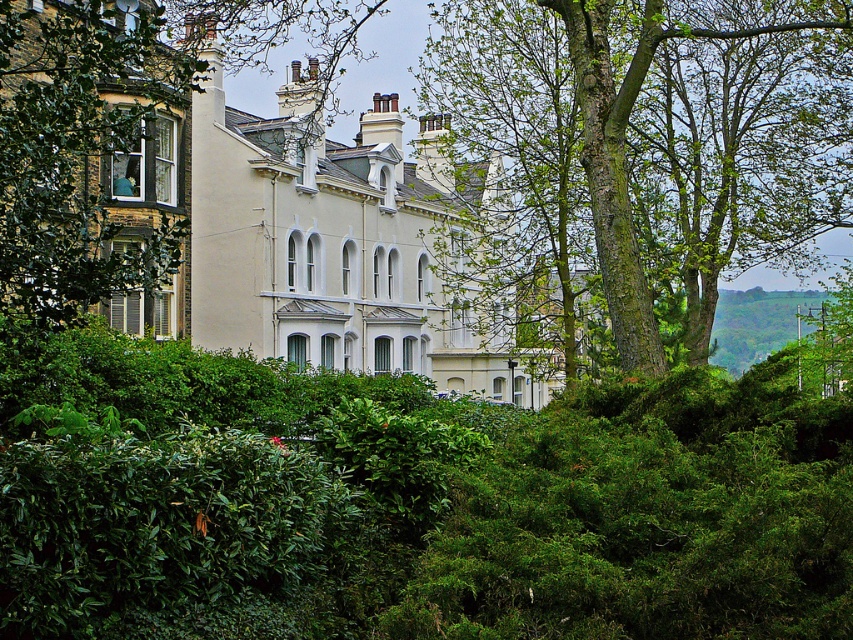
Question: Which object is closer to the camera taking this photo?

Choices:
 (A) beige stone mansion at center
 (B) green bark tree at center

Answer: (A)

Question: Which point is farther to the camera?

Choices:
 (A) (708, 314)
 (B) (212, 200)

Answer: (A)

Question: Can you confirm if green bark tree at center is positioned to the right of beige stone mansion at center?

Choices:
 (A) no
 (B) yes

Answer: (B)

Question: Which point appears farthest from the camera in this image?

Choices:
 (A) (10, 28)
 (B) (253, 346)

Answer: (B)

Question: Is green bark tree at center bigger than beige stone mansion at center?

Choices:
 (A) yes
 (B) no

Answer: (A)

Question: Is green bark tree at center above beige stone mansion at center?

Choices:
 (A) yes
 (B) no

Answer: (A)